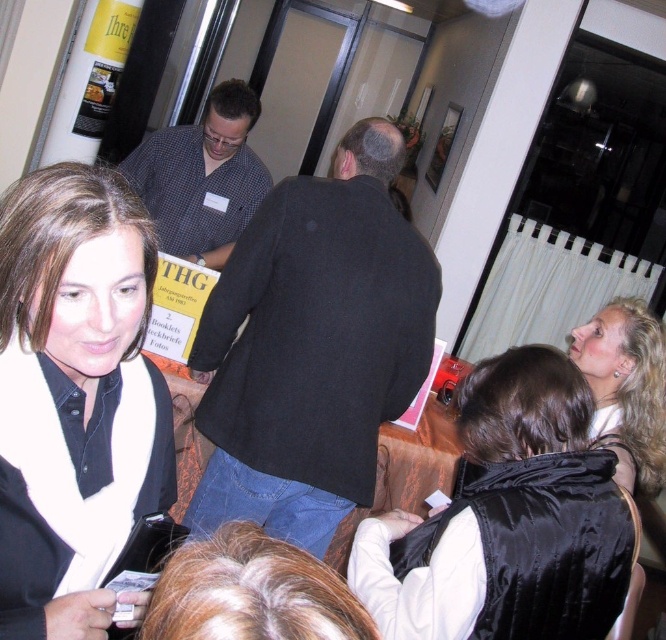
In the scene shown: You are standing in the hallway and see the matte black scarf at lower left and the blonde hair at upper right. Which object is positioned higher up in the image?

The matte black scarf at lower left is positioned above the blonde hair at upper right in the image.

You are attending a networking event and notice two items in the scene. One is the matte black scarf at lower left and the other is the blonde hair at upper right. Which item is smaller in size?

The matte black scarf at lower left is smaller in size compared to the blonde hair at upper right according to the description.

You are organizing a photo shoot and need to position the black satin vest at lower right and the checkered fabric shirt at center for a closeup shot. Given the distance between them, can you fit a 5.5 feet wide camera dolly between them without moving the objects?

The black satin vest at lower right is 5.67 feet from the checkered fabric shirt at center. Since the camera dolly is 5.5 feet wide, there is enough space between them to fit the dolly without moving the objects.